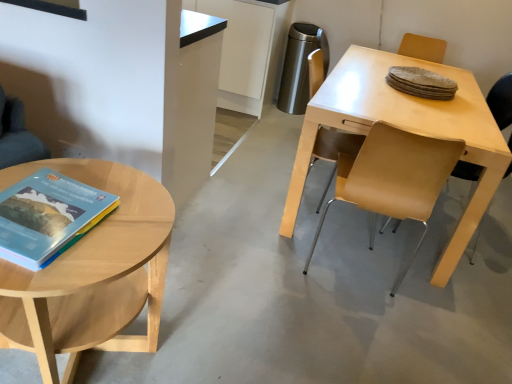
Locate an element on the screen. vacant space in front of light brown leather chair at right, positioned as the 2th chair in left-to-right order is located at coordinates (460, 286).